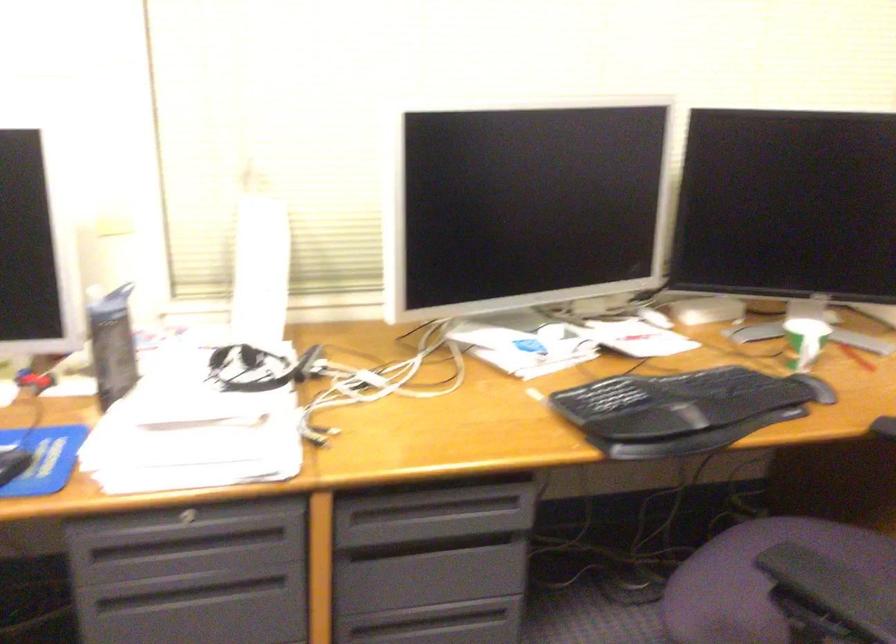
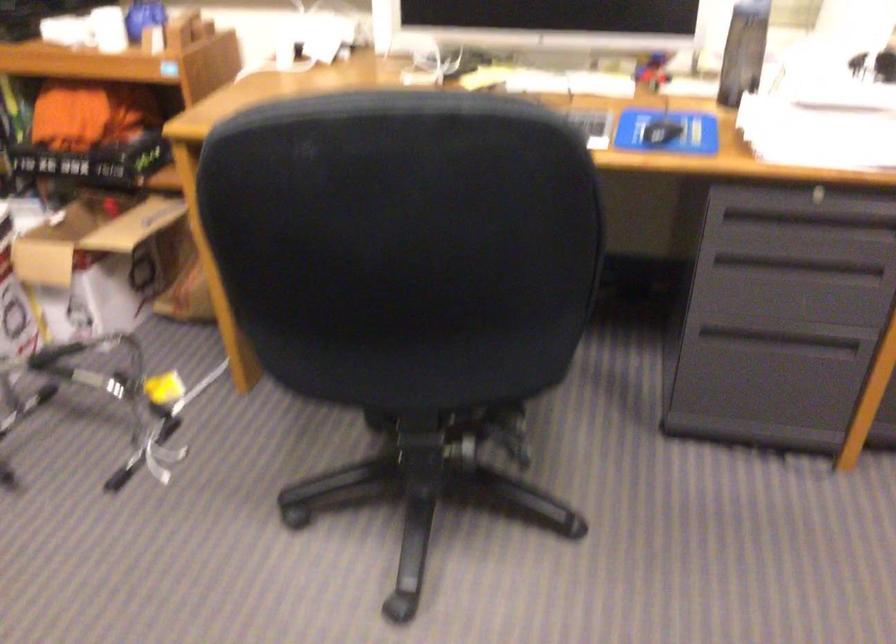
Locate, in the second image, the point that corresponds to pixel 219 524 in the first image.

(840, 200)